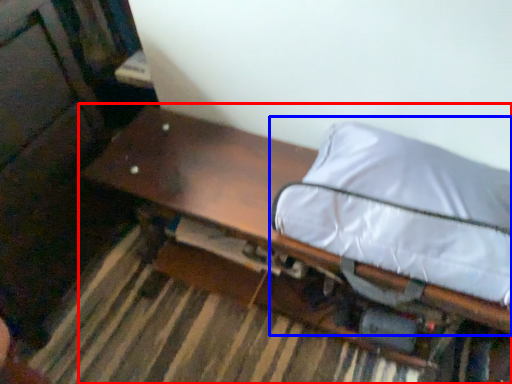
Question: Which of the following is the closest to the observer, furniture (highlighted by a red box) or bean bag chair (highlighted by a blue box)?

Choices:
 (A) furniture
 (B) bean bag chair

Answer: (B)